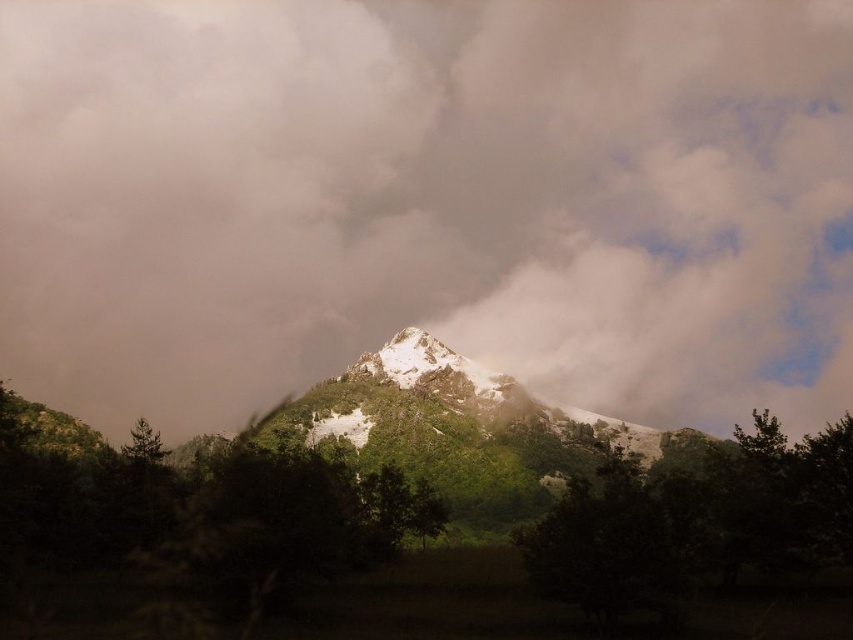
You are standing at the base of the mountain and see two points in the scene. The first point is at coordinates point (x=335, y=172) and the second is at point (x=583, y=492). From your perspective, which point is closer to you?

Point (x=583, y=492) is closer to you because the point (x=335, y=172) is behind it.

You are a photographer standing at the base of the mountain, aiming to capture the white fluffy cloud at center in your shot. Your camera has a maximum zoom range of 200 meters. Can you capture the cloud without moving closer?

The white fluffy cloud at center is 249.65 meters away from the camera. Since the camera can only zoom up to 200 meters, you cannot capture the cloud without moving closer.

You are an observer looking at the mountain scene. You notice a white fluffy cloud at center and a green leafy tree at center. Which object is located more to the left?

The white fluffy cloud at center is positioned on the left side of the green leafy tree at center, so it is more to the left.